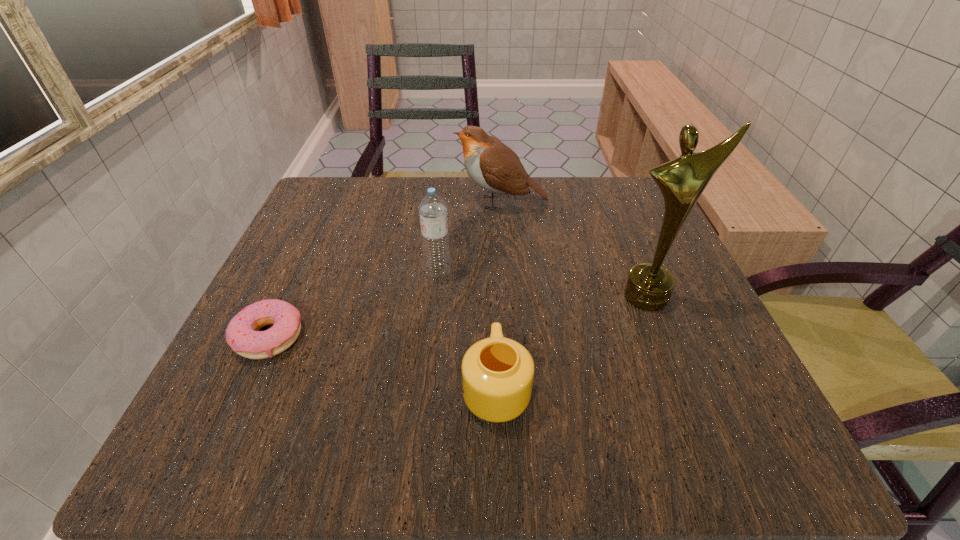
Image resolution: width=960 pixels, height=540 pixels. In order to click on free space located at the face of the bird in this screenshot , I will do `click(416, 202)`.

Locate an element on the screen. This screenshot has width=960, height=540. free space located 0.190m on the back of the second farthest object is located at coordinates (444, 208).

Locate an element on the screen. The height and width of the screenshot is (540, 960). vacant area situated 0.390m on the handle side of the second shortest object is located at coordinates (491, 211).

Where is `vacant space located 0.060m on the handle side of the second shortest object`? vacant space located 0.060m on the handle side of the second shortest object is located at coordinates (494, 323).

You are a GUI agent. You are given a task and a screenshot of the screen. Output one action in this format:
    pyautogui.click(x=<x>, y=<y>)
    Task: Click on the vacant space located on the handle side of the second shortest object
    This screenshot has height=540, width=960.
    Given the screenshot: What is the action you would take?
    pyautogui.click(x=492, y=264)

This screenshot has height=540, width=960. I want to click on free space located 0.290m on the back of the leftmost object, so click(326, 215).

The height and width of the screenshot is (540, 960). Find the location of `object at the far edge`. object at the far edge is located at coordinates (492, 165).

The image size is (960, 540). Identify the location of object at the near edge. (497, 372).

The width and height of the screenshot is (960, 540). In order to click on object located in the left edge section of the desktop in this screenshot , I will do `click(242, 334)`.

Where is `object that is at the right edge`? object that is at the right edge is located at coordinates (649, 287).